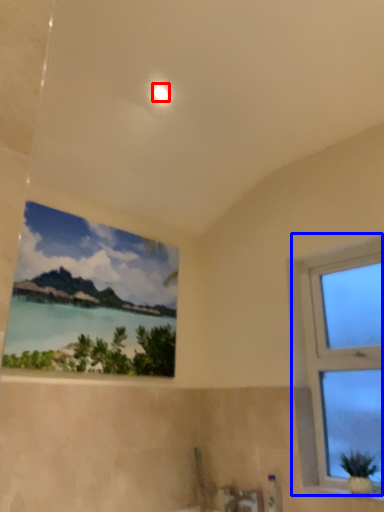
Question: Which of the following is the farthest to the observer, light (highlighted by a red box) or window (highlighted by a blue box)?

Choices:
 (A) light
 (B) window

Answer: (A)